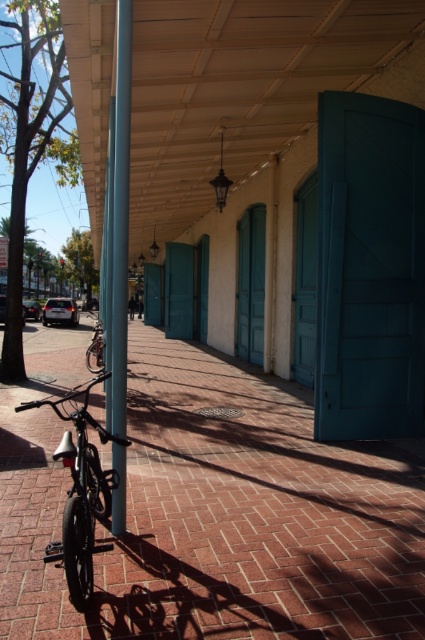
Question: Based on their relative distances, which object is nearer to the shiny silver bicycle at center?

Choices:
 (A) brick pavement at center
 (B) metallic silver pole at center

Answer: (A)

Question: Does brick pavement at center appear on the right side of metallic silver pole at center?

Choices:
 (A) no
 (B) yes

Answer: (A)

Question: Where is brick pavement at center located in relation to shiny silver bicycle at center in the image?

Choices:
 (A) above
 (B) below

Answer: (B)

Question: Which of these objects is positioned farthest from the brick pavement at center?

Choices:
 (A) shiny silver bicycle at center
 (B) metallic silver pole at center
 (C) shiny black bicycle at center

Answer: (A)

Question: Which of the following is the farthest from the observer?

Choices:
 (A) (124, 301)
 (B) (22, 387)
 (C) (88, 467)

Answer: (B)

Question: Is the position of brick pavement at center less distant than that of metallic silver pole at center?

Choices:
 (A) yes
 (B) no

Answer: (A)